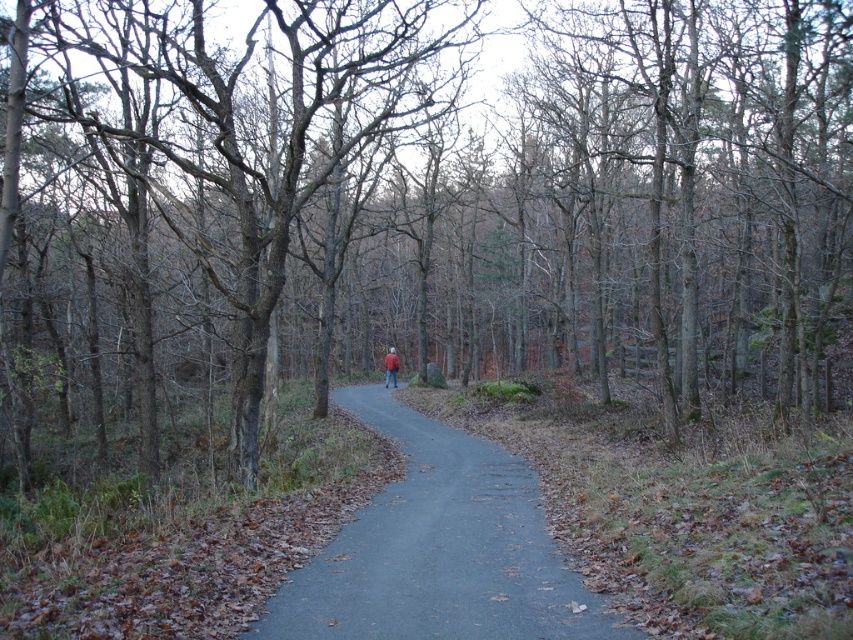
Does smooth asphalt path at center have a larger size compared to red jacket at center?

No, smooth asphalt path at center is not bigger than red jacket at center.

Measure the distance between smooth asphalt path at center and camera.

smooth asphalt path at center is 17.94 feet away from camera.

Locate an element on the screen. The image size is (853, 640). smooth asphalt path at center is located at coordinates (438, 548).